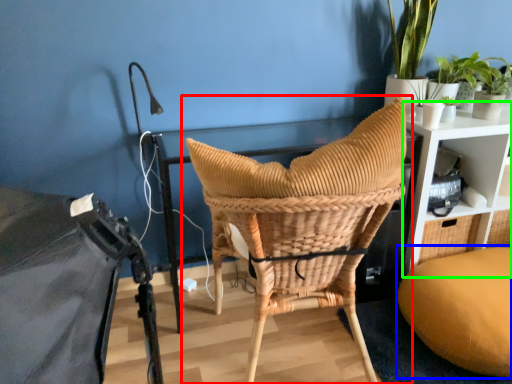
Question: Which object is positioned farthest from chair (highlighted by a red box)? Select from bean bag chair (highlighted by a blue box) and shelf (highlighted by a green box).

Choices:
 (A) bean bag chair
 (B) shelf

Answer: (B)